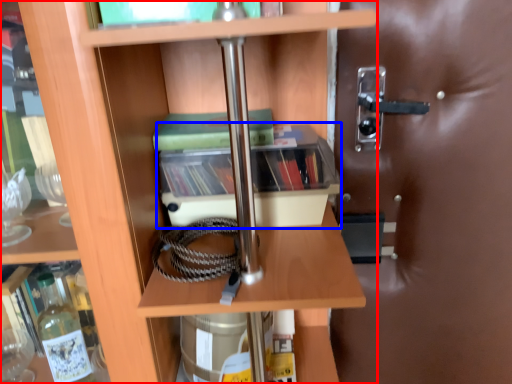
Question: Which object is further to the camera taking this photo, shelf (highlighted by a red box) or cabinetry (highlighted by a blue box)?

Choices:
 (A) shelf
 (B) cabinetry

Answer: (B)